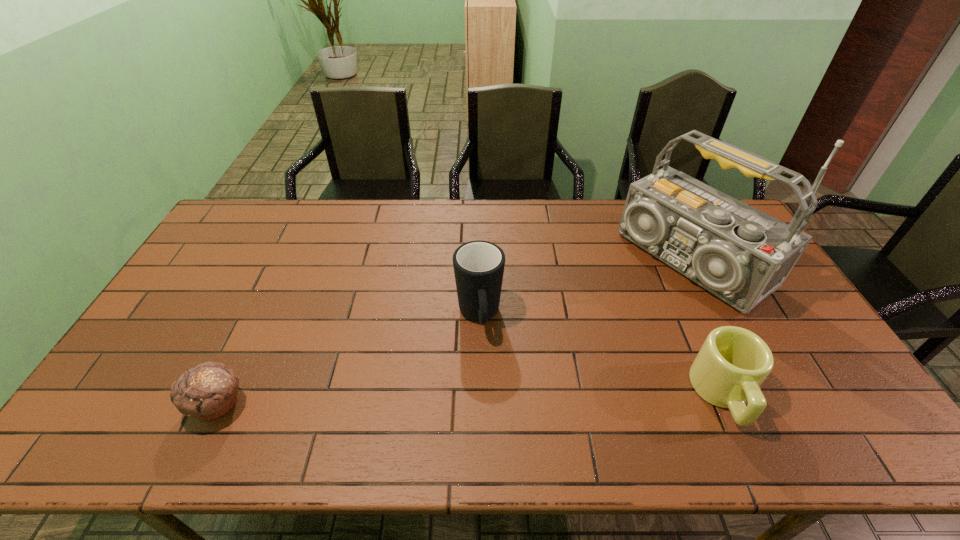
This screenshot has width=960, height=540. In the image, there is a desktop. Find the location of `vacant space at the near edge`. vacant space at the near edge is located at coordinates (482, 383).

What are the coordinates of `vacant space at the left edge of the desktop` in the screenshot? It's located at (171, 353).

Locate an element on the screen. This screenshot has height=540, width=960. free space at the right edge of the desktop is located at coordinates (767, 301).

What are the coordinates of `unoccupied area between the leftmost object and the nearer mug` in the screenshot? It's located at (x=470, y=400).

The width and height of the screenshot is (960, 540). Identify the location of vacant area that lies between the muffin and the nearer mug. (470, 400).

The width and height of the screenshot is (960, 540). Identify the location of unoccupied position between the leftmost object and the third tallest object. (470, 400).

At what (x,y) coordinates should I click in order to perform the action: click on free space between the third shortest object and the shorter mug. Please return your answer as a coordinate pair (x, y). Image resolution: width=960 pixels, height=540 pixels. Looking at the image, I should click on (601, 355).

This screenshot has width=960, height=540. I want to click on free point between the radio receiver and the muffin, so click(x=455, y=332).

This screenshot has height=540, width=960. Find the location of `vacant point located between the shorter mug and the tallest object`. vacant point located between the shorter mug and the tallest object is located at coordinates (708, 327).

This screenshot has height=540, width=960. I want to click on empty location between the tallest object and the leftmost object, so click(455, 332).